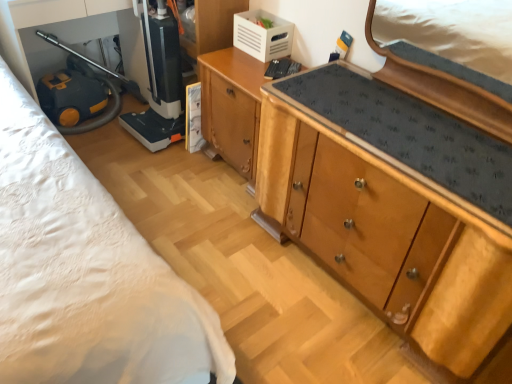
Where is `free space in front of black plastic vacuum cleaner at lower left, the 2th appliance in the right-to-left sequence`? The width and height of the screenshot is (512, 384). free space in front of black plastic vacuum cleaner at lower left, the 2th appliance in the right-to-left sequence is located at coordinates (147, 164).